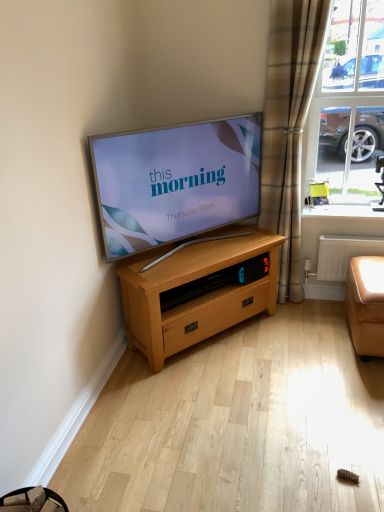
This screenshot has width=384, height=512. Identify the location of vacant space in front of plaid fabric curtain at right. pos(307,317).